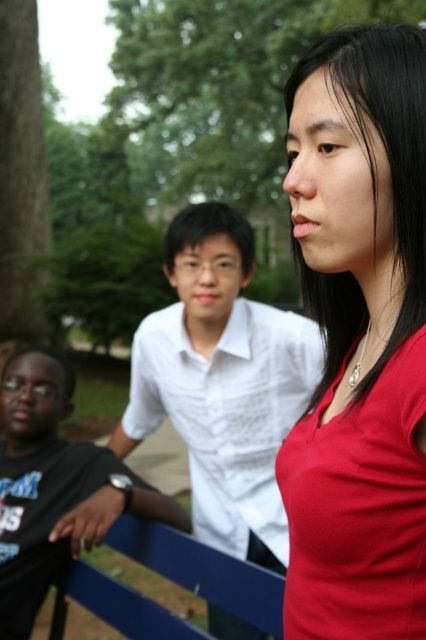
Question: Is matte red shirt at right closer to camera compared to white cotton shirt at center?

Choices:
 (A) yes
 (B) no

Answer: (A)

Question: Considering the real-world distances, which object is closest to the white cotton shirt at center?

Choices:
 (A) black matte shirt at left
 (B) matte red shirt at right

Answer: (A)

Question: Among these objects, which one is nearest to the camera?

Choices:
 (A) white cotton shirt at center
 (B) black matte shirt at left

Answer: (B)

Question: Considering the relative positions of white cotton shirt at center and black matte shirt at left in the image provided, where is white cotton shirt at center located with respect to black matte shirt at left?

Choices:
 (A) above
 (B) below

Answer: (A)

Question: Can you confirm if matte red shirt at right is positioned below black matte shirt at left?

Choices:
 (A) no
 (B) yes

Answer: (A)

Question: Which point is closer to the camera taking this photo?

Choices:
 (A) (207, 524)
 (B) (371, 228)
 (C) (14, 442)

Answer: (B)